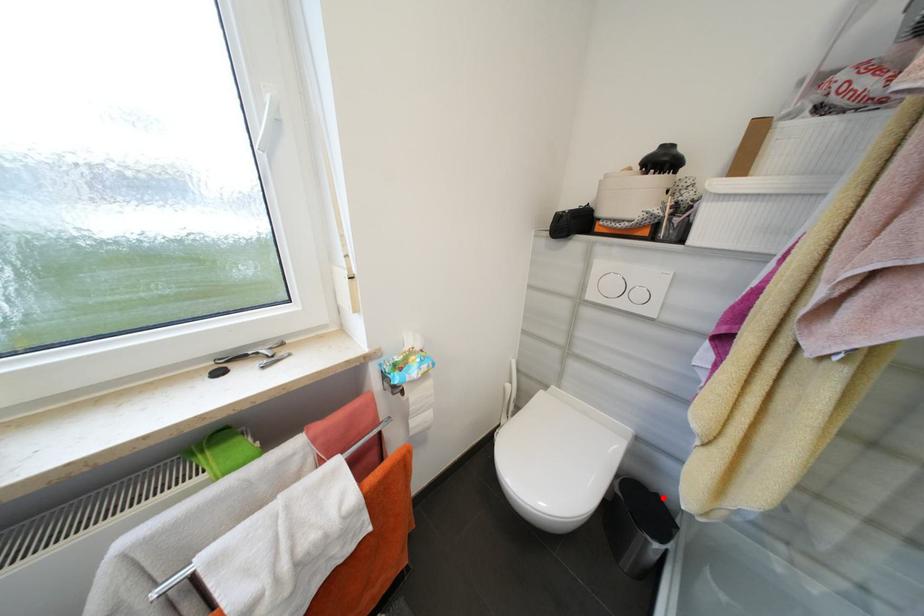
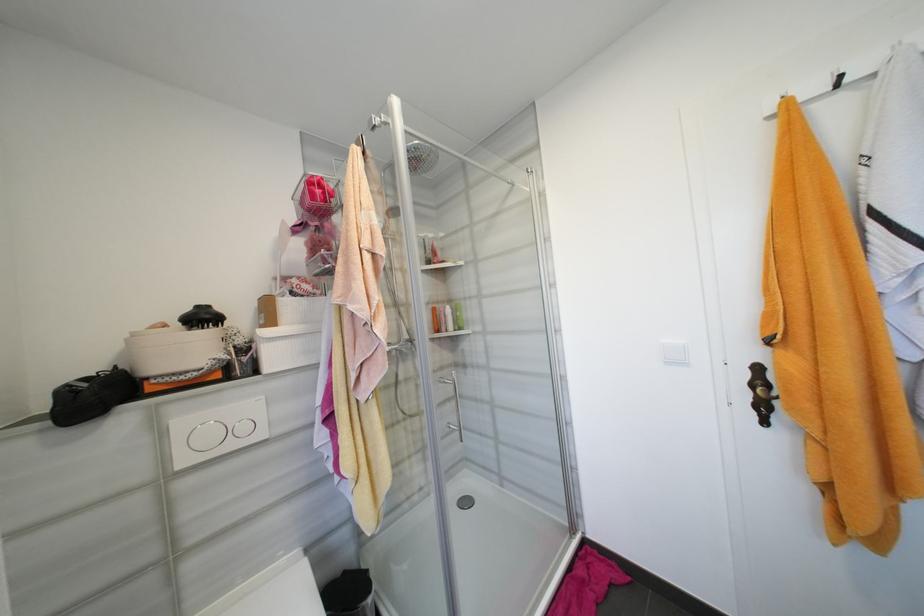
In the second image, find the point that corresponds to the highlighted location in the first image.

(350, 573)